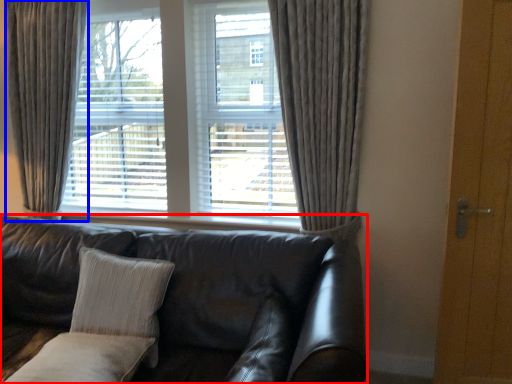
Question: Among these objects, which one is farthest to the camera, studio couch (highlighted by a red box) or curtain (highlighted by a blue box)?

Choices:
 (A) studio couch
 (B) curtain

Answer: (B)